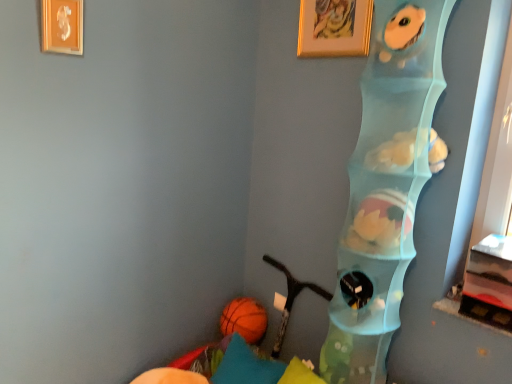
Question: Is teal fabric pillow at lower left looking in the opposite direction of white plush toy at center, the 2th animal positioned from the top?

Choices:
 (A) no
 (B) yes

Answer: (A)

Question: From the image's perspective, is teal fabric pillow at lower left above white plush toy at center, the 2th animal positioned from the top?

Choices:
 (A) no
 (B) yes

Answer: (A)

Question: Would you consider teal fabric pillow at lower left to be distant from white plush toy at center, the 2th animal positioned from the top?

Choices:
 (A) yes
 (B) no

Answer: (A)

Question: Is white plush toy at center, the 2th animal positioned from the top, surrounded by teal fabric pillow at lower left?

Choices:
 (A) no
 (B) yes

Answer: (A)

Question: Is teal fabric pillow at lower left with white plush toy at center, the 2th animal positioned from the top?

Choices:
 (A) no
 (B) yes

Answer: (A)

Question: Considering the relative positions of gold-framed picture at upper center, which is the first picture frame in back-to-front order, and teal fabric pillow at lower left in the image provided, is gold-framed picture at upper center, which is the first picture frame in back-to-front order, to the left or to the right of teal fabric pillow at lower left?

Choices:
 (A) right
 (B) left

Answer: (A)

Question: Considering their positions, is gold-framed picture at upper center, placed as the 2th picture frame when sorted from front to back, located in front of or behind teal fabric pillow at lower left?

Choices:
 (A) front
 (B) behind

Answer: (A)

Question: Considering the positions of gold-framed picture at upper center, which is the first picture frame in right-to-left order, and teal fabric pillow at lower left in the image, is gold-framed picture at upper center, which is the first picture frame in right-to-left order, wider or thinner than teal fabric pillow at lower left?

Choices:
 (A) thin
 (B) wide

Answer: (A)

Question: Considering the positions of gold-framed picture at upper center, which is the first picture frame in back-to-front order, and teal fabric pillow at lower left in the image, is gold-framed picture at upper center, which is the first picture frame in back-to-front order, taller or shorter than teal fabric pillow at lower left?

Choices:
 (A) short
 (B) tall

Answer: (B)

Question: Considering the positions of point (417, 67) and point (238, 316), is point (417, 67) closer or farther from the camera than point (238, 316)?

Choices:
 (A) farther
 (B) closer

Answer: (B)

Question: From the image's perspective, is translucent plastic shelf at right located above or below orange rubber ball at lower left?

Choices:
 (A) below
 (B) above

Answer: (B)

Question: Is translucent plastic shelf at right to the left or to the right of orange rubber ball at lower left in the image?

Choices:
 (A) right
 (B) left

Answer: (A)

Question: Would you say translucent plastic shelf at right is inside or outside orange rubber ball at lower left?

Choices:
 (A) inside
 (B) outside

Answer: (B)

Question: Looking at their shapes, would you say white plush toy at center, the 1th animal positioned from the bottom, is wider or thinner than fluffy blue plush toy at upper right, the second animal positioned from the bottom?

Choices:
 (A) wide
 (B) thin

Answer: (A)

Question: From a real-world perspective, is white plush toy at center, the 2th animal positioned from the top, above or below fluffy blue plush toy at upper right, arranged as the first animal when viewed from the top?

Choices:
 (A) below
 (B) above

Answer: (A)